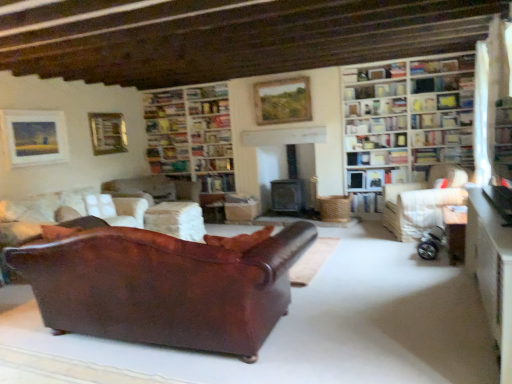
Question: Is white wooden bookcase at upper right, the 1th bookcase viewed from the front, next to silver metallic baby carriage at lower right and touching it?

Choices:
 (A) yes
 (B) no

Answer: (B)

Question: Is white wooden bookcase at upper right, the 1th bookcase viewed from the front, to the right of silver metallic baby carriage at lower right from the viewer's perspective?

Choices:
 (A) yes
 (B) no

Answer: (A)

Question: Can we say white wooden bookcase at upper right, the first bookcase from the right, lies outside silver metallic baby carriage at lower right?

Choices:
 (A) yes
 (B) no

Answer: (A)

Question: Could you tell me if white wooden bookcase at upper right, which is the 2th bookcase in left-to-right order, is facing silver metallic baby carriage at lower right?

Choices:
 (A) no
 (B) yes

Answer: (B)

Question: Is white wooden bookcase at upper right, the first bookcase from the right, closer to camera compared to silver metallic baby carriage at lower right?

Choices:
 (A) no
 (B) yes

Answer: (A)

Question: From the image's perspective, is white fabric curtain at upper right located above or below wooden table at lower right, the 1th table in the right-to-left sequence?

Choices:
 (A) above
 (B) below

Answer: (A)

Question: Considering the positions of white fabric curtain at upper right and wooden table at lower right, the 3th table viewed from the left, in the image, is white fabric curtain at upper right taller or shorter than wooden table at lower right, the 3th table viewed from the left,?

Choices:
 (A) tall
 (B) short

Answer: (A)

Question: Looking at the image, does white fabric curtain at upper right seem bigger or smaller compared to wooden table at lower right, which appears as the second table when viewed from the front?

Choices:
 (A) big
 (B) small

Answer: (A)

Question: Based on their positions, is white fabric curtain at upper right located to the left or right of wooden table at lower right, the 3th table viewed from the left?

Choices:
 (A) left
 (B) right

Answer: (B)

Question: Considering the positions of hardcover book at upper right, the 5th book when ordered from left to right, and wooden bookshelf at upper right, the first shelf viewed from the top, in the image, is hardcover book at upper right, the 5th book when ordered from left to right, taller or shorter than wooden bookshelf at upper right, the first shelf viewed from the top,?

Choices:
 (A) short
 (B) tall

Answer: (A)

Question: From the image's perspective, is hardcover book at upper right, the 5th book ordered from the bottom, above or below wooden bookshelf at upper right, which is the 4th shelf in left-to-right order?

Choices:
 (A) above
 (B) below

Answer: (B)

Question: Does point (391, 122) appear closer or farther from the camera than point (418, 79)?

Choices:
 (A) closer
 (B) farther

Answer: (B)

Question: Visually, is hardcover book at upper right, the 5th book when ordered from left to right, positioned to the left or to the right of wooden bookshelf at upper right, which is the 4th shelf in left-to-right order?

Choices:
 (A) left
 (B) right

Answer: (A)

Question: Based on their positions, is white wooden bookcase at upper right, which is the 2th bookcase in back-to-front order, located to the left or right of hardcover book at center, the 1th book positioned from the left?

Choices:
 (A) left
 (B) right

Answer: (B)

Question: From a real-world perspective, is white wooden bookcase at upper right, which is the 2th bookcase in back-to-front order, physically located above or below hardcover book at center, marked as the third book in a top-to-bottom arrangement?

Choices:
 (A) below
 (B) above

Answer: (B)